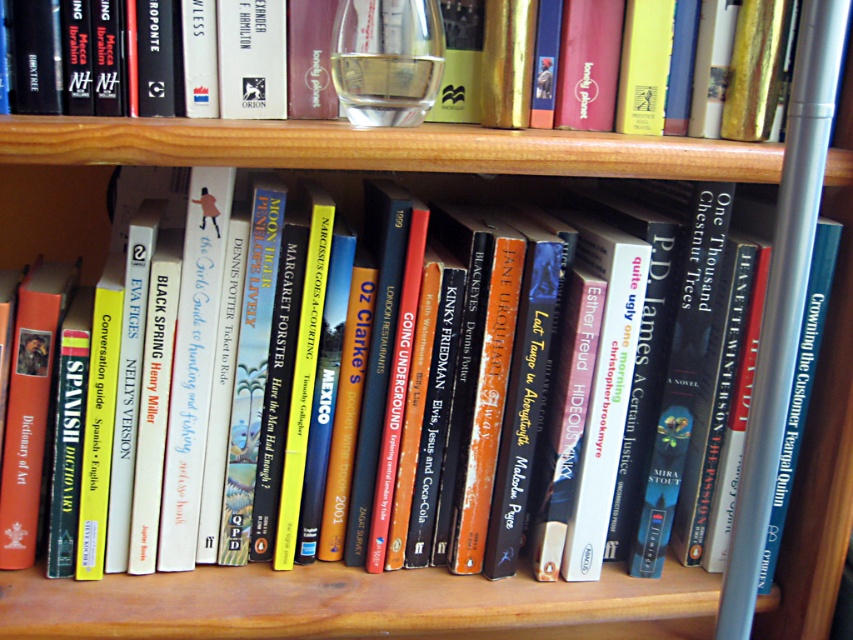
You are organizing a bookshelf and notice the gold hardcover book at upper center and the clear glass wine glass at center. Which object is positioned to the right of the other?

The gold hardcover book at upper center is to the right of the clear glass wine glass at center.

Where is the gold hardcover book at upper center located in the image?

The gold hardcover book at upper center is located at point 0.102 in the horizontal axis and 0.367 in the vertical axis.